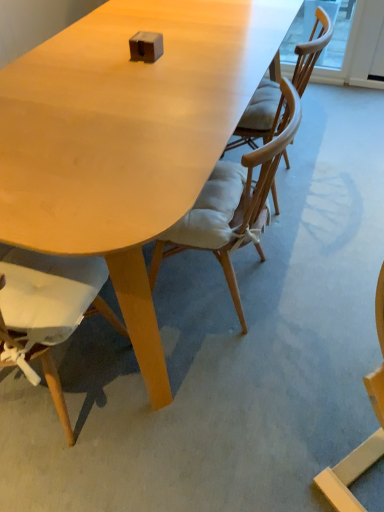
Locate an element on the screen. vacant area located to the right-hand side of light brown wood chair at center, which is counted as the 2th chair, starting from the right is located at coordinates (312, 284).